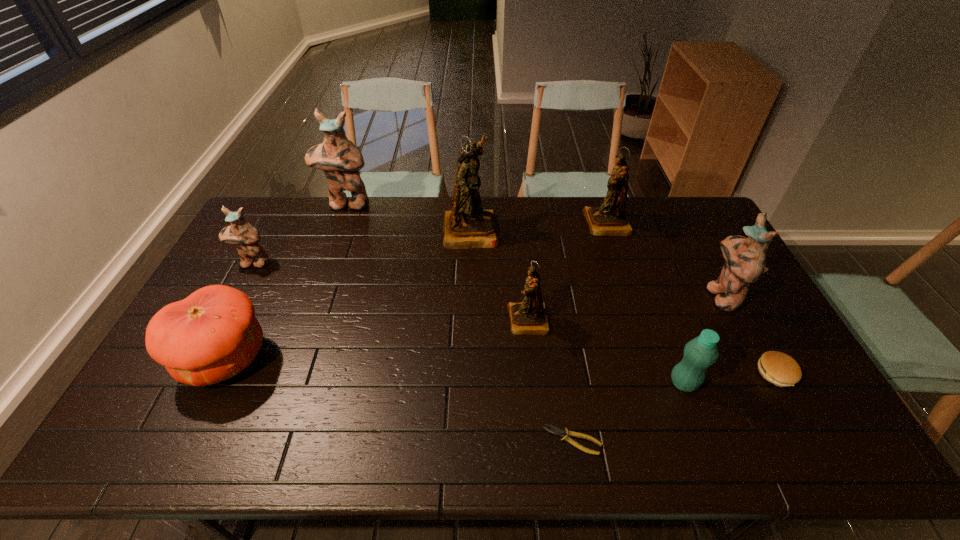
Find the location of a particular element. The width and height of the screenshot is (960, 540). the fourth figurine from left to right is located at coordinates (529, 317).

Locate an element on the screen. the smallest gold figurine is located at coordinates (529, 317).

The width and height of the screenshot is (960, 540). I want to click on pumpkin, so click(x=212, y=335).

This screenshot has width=960, height=540. Identify the location of water bottle. (701, 352).

The image size is (960, 540). I want to click on the second shortest object, so click(x=776, y=367).

The width and height of the screenshot is (960, 540). I want to click on the nearest object, so click(557, 431).

Find the location of a particular element. The height and width of the screenshot is (540, 960). pliers is located at coordinates (557, 431).

In order to click on vacant space located on the front-facing side of the second figurine from left to right in this screenshot , I will do `click(327, 258)`.

Find the location of `free spot located 0.260m on the front-facing side of the biggest gold figurine`. free spot located 0.260m on the front-facing side of the biggest gold figurine is located at coordinates (570, 229).

Identify the location of vacant space located on the front-facing side of the fifth figurine from left to right. (536, 224).